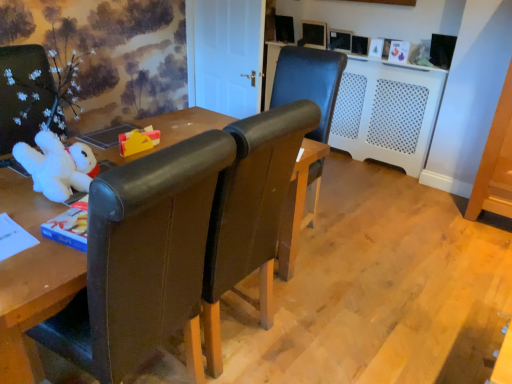
Question: Is white plastic radiator at center positioned behind leather chair at left, the second chair from the back?

Choices:
 (A) no
 (B) yes

Answer: (B)

Question: Can you confirm if white plastic radiator at center is wider than leather chair at left, positioned as the 1th chair in front-to-back order?

Choices:
 (A) yes
 (B) no

Answer: (B)

Question: From a real-world perspective, does white plastic radiator at center sit lower than leather chair at left, positioned as the 1th chair in front-to-back order?

Choices:
 (A) yes
 (B) no

Answer: (A)

Question: Is white plastic radiator at center in contact with leather chair at left, positioned as the 1th chair in front-to-back order?

Choices:
 (A) no
 (B) yes

Answer: (A)

Question: From a real-world perspective, is white plastic radiator at center on top of leather chair at left, positioned as the 1th chair in left-to-right order?

Choices:
 (A) yes
 (B) no

Answer: (B)

Question: Can you confirm if white plastic radiator at center is shorter than leather chair at left, which is the second chair from right to left?

Choices:
 (A) no
 (B) yes

Answer: (B)

Question: Could you tell me if white plush toy at left, which is the second toy in back-to-front order, is facing leather chair at left, positioned as the 1th chair in front-to-back order?

Choices:
 (A) no
 (B) yes

Answer: (B)

Question: Does white plush toy at left, which is the second toy in back-to-front order, have a lesser height compared to leather chair at left, which is the second chair from right to left?

Choices:
 (A) yes
 (B) no

Answer: (A)

Question: Is white plush toy at left, which is the second toy in back-to-front order, further to the viewer compared to leather chair at left, the second chair from the back?

Choices:
 (A) no
 (B) yes

Answer: (B)

Question: Does white plush toy at left, the 1th toy in the front-to-back sequence, have a larger size compared to leather chair at left, positioned as the 1th chair in front-to-back order?

Choices:
 (A) yes
 (B) no

Answer: (B)

Question: From the image's perspective, is white plush toy at left, which is the second toy in back-to-front order, on leather chair at left, which is the second chair from right to left?

Choices:
 (A) yes
 (B) no

Answer: (A)

Question: Is leather chair at left, positioned as the 1th chair in front-to-back order, at the back of white plush toy at left, which is the second toy in back-to-front order?

Choices:
 (A) no
 (B) yes

Answer: (A)

Question: Is leather chair at left, the second chair from the back, positioned with its back to leather chair at center, which ranks as the 2th chair in left-to-right order?

Choices:
 (A) yes
 (B) no

Answer: (B)